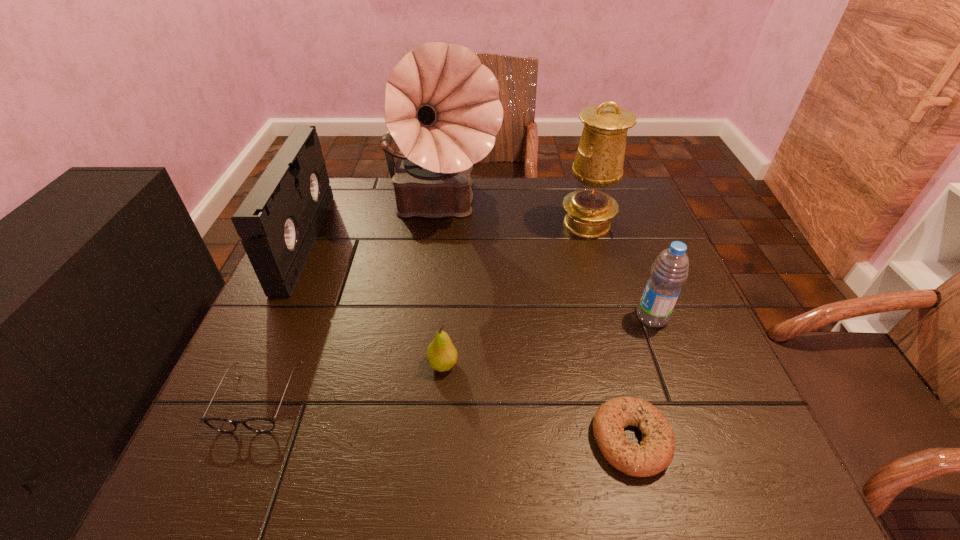
Where is `free space at the near right corner of the desktop`? free space at the near right corner of the desktop is located at coordinates (717, 475).

Where is `vacant point located between the videotape and the tallest object`? vacant point located between the videotape and the tallest object is located at coordinates (372, 225).

Identify the location of vacant area between the pear and the record player. The width and height of the screenshot is (960, 540). (442, 286).

Where is `free space between the videotape and the water bottle`? Image resolution: width=960 pixels, height=540 pixels. free space between the videotape and the water bottle is located at coordinates (478, 280).

Where is `vacant space that is in between the water bottle and the videotape`? The height and width of the screenshot is (540, 960). vacant space that is in between the water bottle and the videotape is located at coordinates (478, 280).

You are a GUI agent. You are given a task and a screenshot of the screen. Output one action in this format:
    pyautogui.click(x=<x>, y=<y>)
    Task: Click on the free spot between the fourth nearest object and the bagel
    
    Given the screenshot: What is the action you would take?
    pyautogui.click(x=641, y=379)

Where is `unoccupied area between the spectacles and the tallest object`? This screenshot has width=960, height=540. unoccupied area between the spectacles and the tallest object is located at coordinates (350, 303).

At what (x,y) coordinates should I click in order to perform the action: click on free space between the videotape and the spectacles. Please return your answer as a coordinate pair (x, y). This screenshot has height=540, width=960. Looking at the image, I should click on (282, 320).

Find the location of a particular element. unoccupied position between the record player and the videotape is located at coordinates (372, 225).

The height and width of the screenshot is (540, 960). Identify the location of empty space between the spectacles and the videotape. (282, 320).